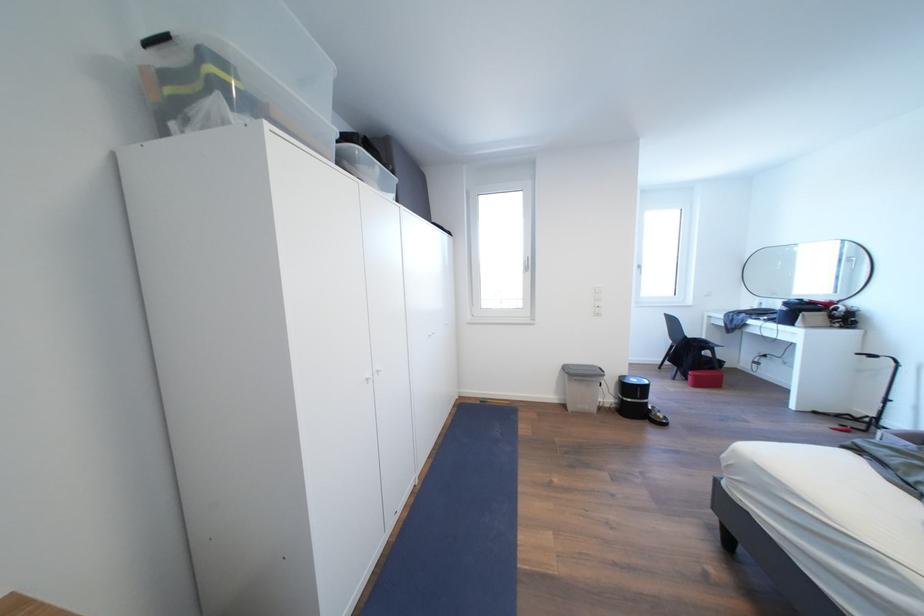
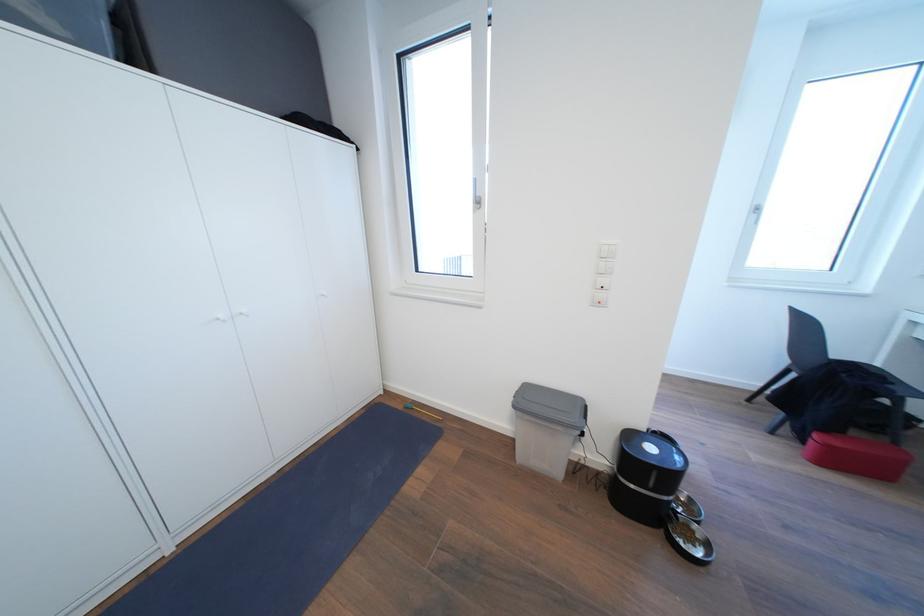
In a continuous first-person perspective shot, in which direction is the camera moving?

The cameraman walked toward right, forward.